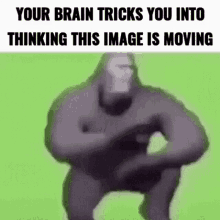
Find the location of a particular element. The image size is (220, 220). chest is located at coordinates (119, 128).